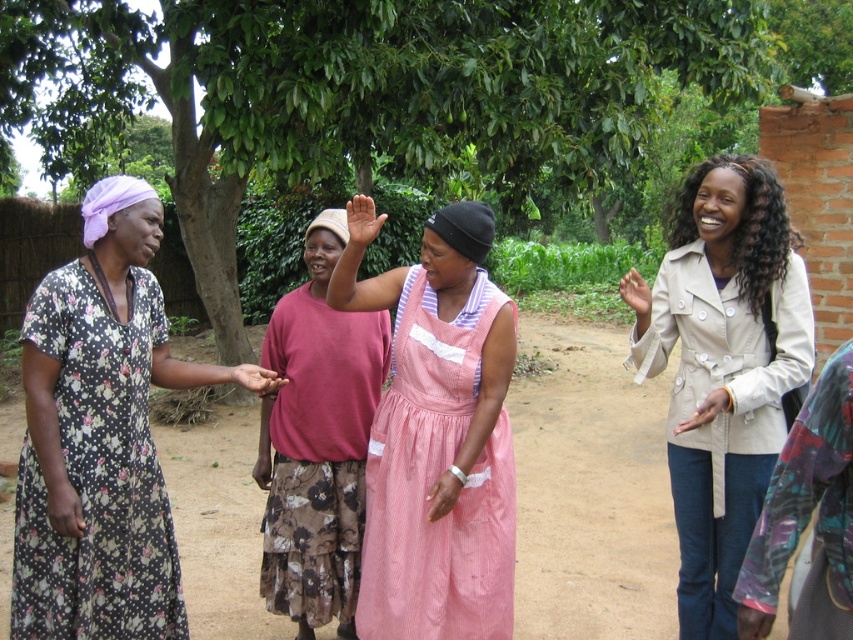
Question: Is beige cotton coat at upper right smaller than floral printed dress at left?

Choices:
 (A) yes
 (B) no

Answer: (B)

Question: Can you confirm if brown dirt field at center is bigger than pink corduroy dress at center?

Choices:
 (A) no
 (B) yes

Answer: (B)

Question: Which object appears farthest from the camera in this image?

Choices:
 (A) floral printed dress at left
 (B) beige cotton coat at upper right

Answer: (B)

Question: Considering the relative positions of beige cotton coat at upper right and pink corduroy dress at center in the image provided, where is beige cotton coat at upper right located with respect to pink corduroy dress at center?

Choices:
 (A) below
 (B) above

Answer: (B)

Question: Which point is farther to the camera?

Choices:
 (A) beige cotton coat at upper right
 (B) matte pink shirt at center
 (C) brown dirt field at center

Answer: (C)

Question: Which point appears closest to the camera in this image?

Choices:
 (A) (538, 394)
 (B) (122, 452)
 (C) (741, 477)

Answer: (B)